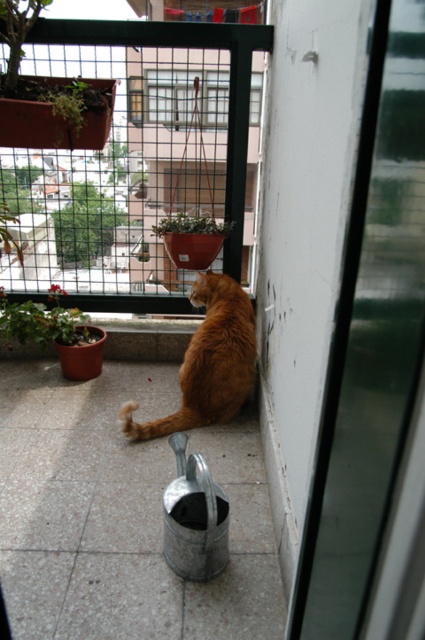
You are standing at the point labeled point (235, 369) and want to move to point (189, 221). Which direction should you move to get closer to your destination?

To move from point (235, 369) to point (189, 221), you should move diagonally towards the upper left direction since point (189, 221) is located at a higher y coordinate and lower x coordinate compared to point (235, 369).

You are a delivery person trying to hand a package to the resident through the transparent glass screen door at upper right. However, there is a green matte plant at center in the way. Can you easily reach the door without moving the plant?

The transparent glass screen door at upper right is in front of the green matte plant at center, so you can easily reach the door without needing to move the plant.

You are a delivery person trying to determine if you can see the green matte plant at center through the transparent glass screen door at upper right. Based on their heights, can you see the plant?

The transparent glass screen door at upper right has a greater height compared to green matte plant at center, so the door is taller than the plant. Since the door is taller, it might block your view of the plant unless you can look over or around it. However, without additional information about the door and plant positions, we can only confirm the height difference.